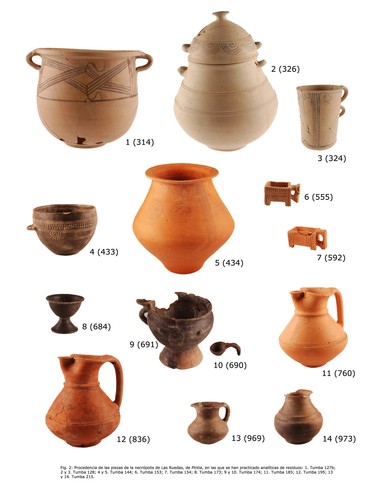
Locate an element on the screen. The width and height of the screenshot is (376, 500). small  brown pitcher is located at coordinates (209, 424).